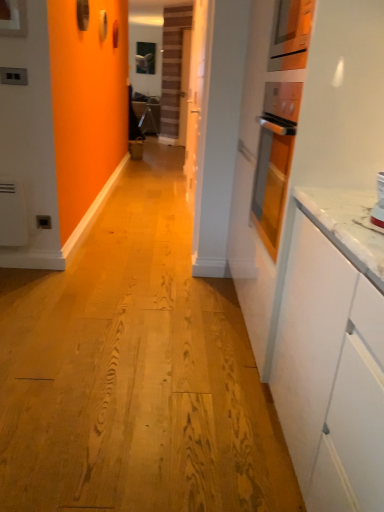
The width and height of the screenshot is (384, 512). Describe the element at coordinates (197, 104) in the screenshot. I see `wooden door at center` at that location.

Identify the location of wooden door at center. The width and height of the screenshot is (384, 512). (197, 104).

The image size is (384, 512). Identify the location of wooden door at center. (197, 104).